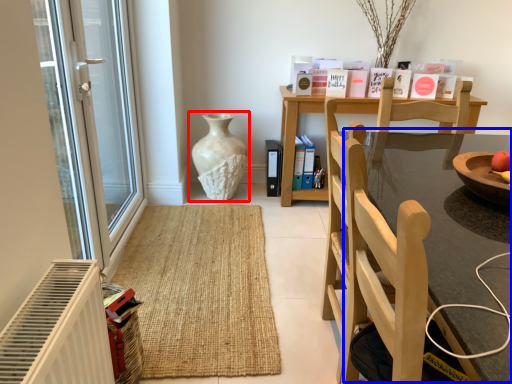
Question: Which of the following is the closest to the observer, vase (highlighted by a red box) or round table (highlighted by a blue box)?

Choices:
 (A) vase
 (B) round table

Answer: (B)